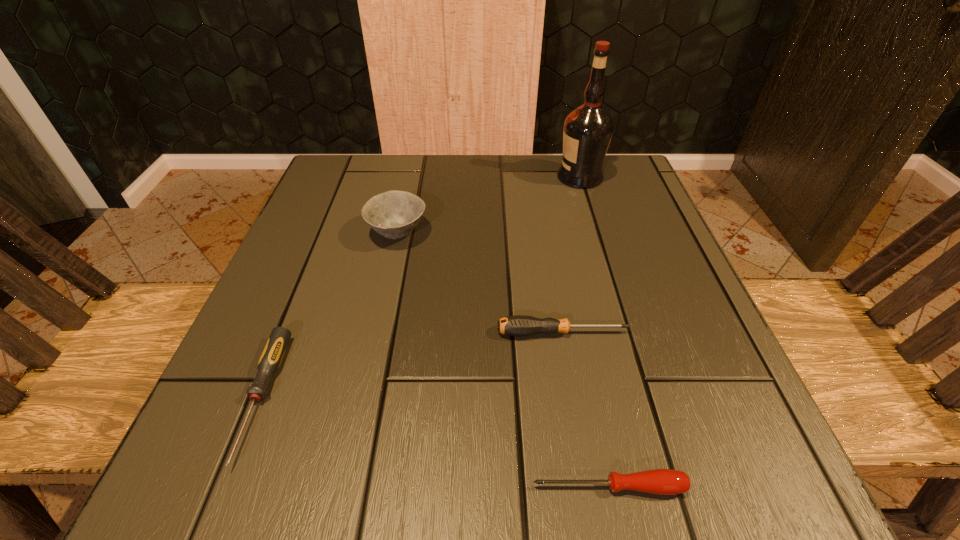
Image resolution: width=960 pixels, height=540 pixels. In order to click on vacant space at the right edge in this screenshot , I will do `click(679, 332)`.

Image resolution: width=960 pixels, height=540 pixels. What are the coordinates of `vacant area at the far left corner of the desktop` in the screenshot? It's located at (387, 183).

I want to click on vacant space at the near left corner of the desktop, so click(x=235, y=487).

The height and width of the screenshot is (540, 960). What are the coordinates of `free space at the far right corner of the desktop` in the screenshot? It's located at (636, 202).

Locate an element on the screen. The height and width of the screenshot is (540, 960). blank region between the second tallest object and the leftmost object is located at coordinates (329, 315).

Identify the location of vacant area that lies between the nearest screwdriver and the liquor. This screenshot has width=960, height=540. (594, 332).

Identify the location of free space between the second object from left to right and the nearest object. This screenshot has height=540, width=960. (503, 360).

Identify the location of free spot between the nearest screwdriver and the liquor. Image resolution: width=960 pixels, height=540 pixels. pyautogui.click(x=594, y=332).

Where is `free space that is in between the liquor and the fourth shortest object`? This screenshot has width=960, height=540. free space that is in between the liquor and the fourth shortest object is located at coordinates (489, 205).

You are a GUI agent. You are given a task and a screenshot of the screen. Output one action in this format:
    pyautogui.click(x=<x>, y=<y>)
    Task: Click on the free spot between the nearest object and the second tallest object
    This screenshot has width=960, height=540.
    Given the screenshot: What is the action you would take?
    pyautogui.click(x=503, y=360)